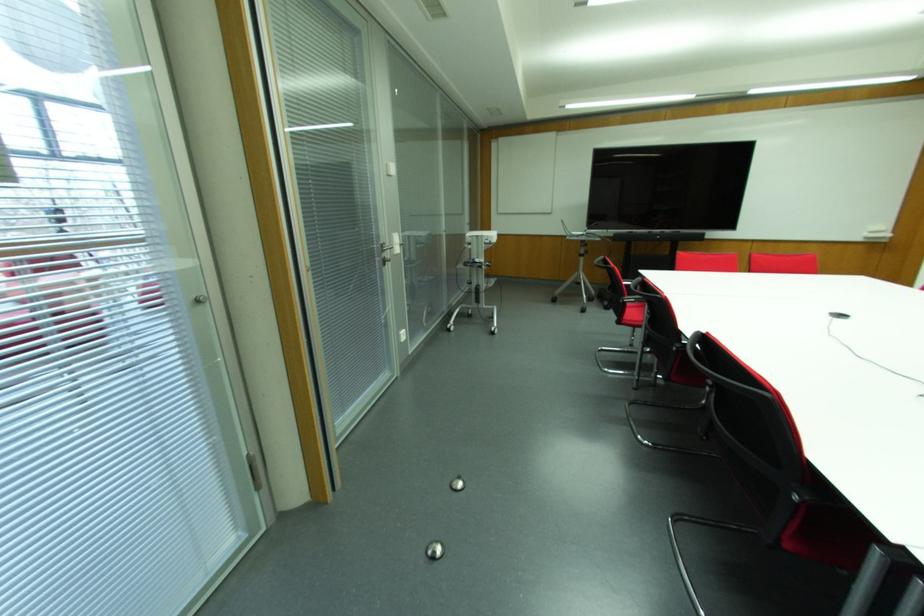
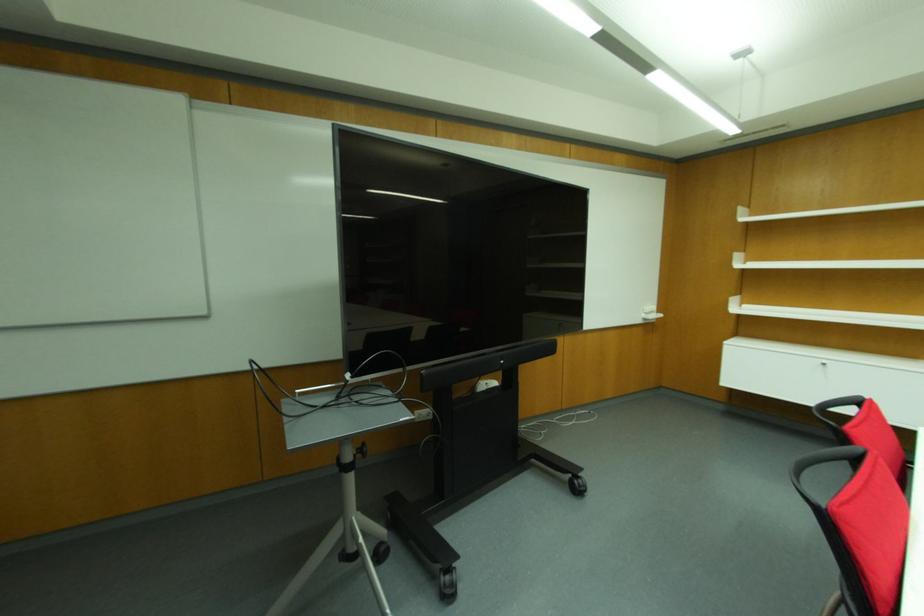
Where in the second image is the point corresponding to point (606, 307) from the first image?

(448, 594)